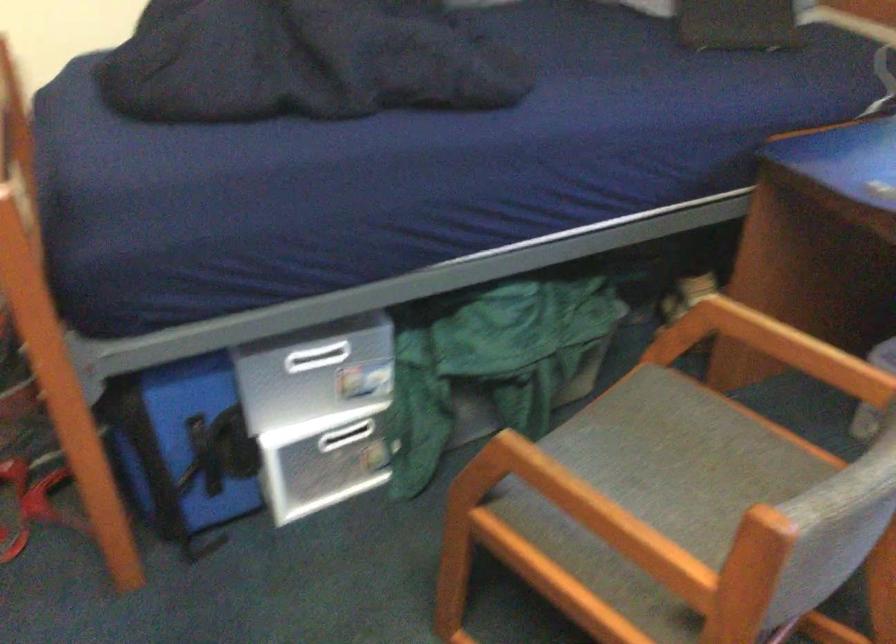
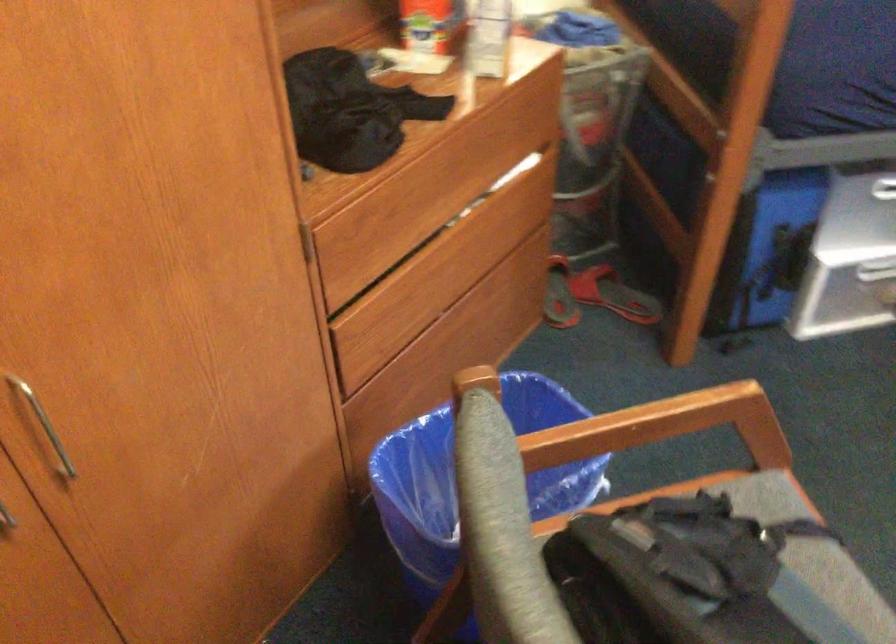
Question: The images are taken continuously from a first-person perspective. In which direction is your viewpoint rotating?

Choices:
 (A) Left
 (B) Right
 (C) Up
 (D) Down

Answer: (A)